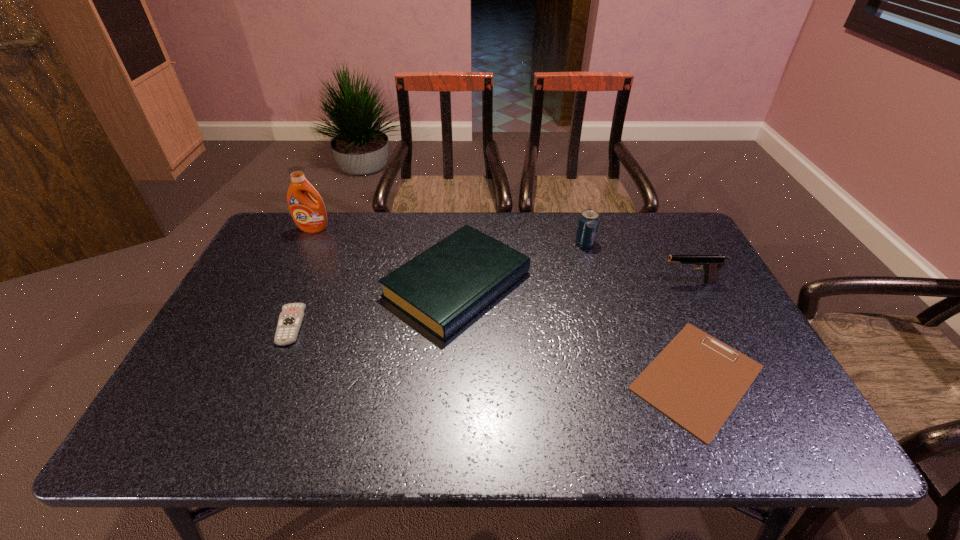
This screenshot has height=540, width=960. In order to click on detergent present at the left edge in this screenshot , I will do `click(309, 215)`.

Find the location of `remote control located in the left edge section of the desktop`. remote control located in the left edge section of the desktop is located at coordinates (290, 319).

Identify the location of pistol present at the right edge. (711, 264).

You are a GUI agent. You are given a task and a screenshot of the screen. Output one action in this format:
    pyautogui.click(x=<x>, y=<y>)
    Task: Click on the clipboard at the right edge
    Image resolution: width=960 pixels, height=540 pixels.
    Given the screenshot: What is the action you would take?
    pyautogui.click(x=696, y=380)

Identify the location of object situated at the far left corner. (309, 215).

Locate an element on the screen. The height and width of the screenshot is (540, 960). object that is at the near right corner is located at coordinates (696, 380).

Locate an element on the screen. vacant space at the far edge of the desktop is located at coordinates (571, 225).

Find the location of a particular element. Image resolution: width=960 pixels, height=540 pixels. vacant space at the near edge of the desktop is located at coordinates (506, 416).

This screenshot has height=540, width=960. In the image, there is a desktop. In order to click on free space at the left edge in this screenshot , I will do `click(264, 334)`.

You are a GUI agent. You are given a task and a screenshot of the screen. Output one action in this format:
    pyautogui.click(x=<x>, y=<y>)
    Task: Click on the free region at the right edge of the desktop
    
    Given the screenshot: What is the action you would take?
    pyautogui.click(x=698, y=278)